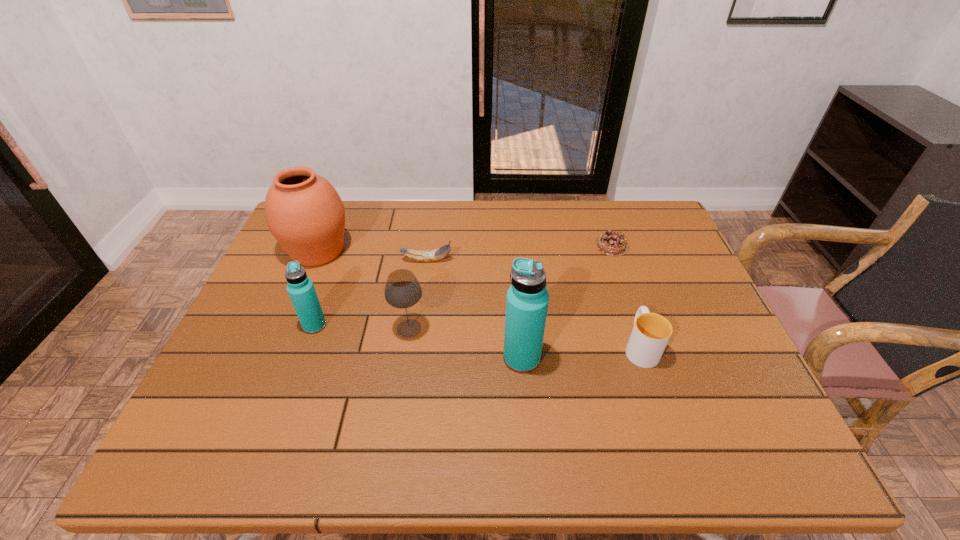
Find the location of `object present at the left edge`. object present at the left edge is located at coordinates (303, 211).

Where is `object present at the right edge`? Image resolution: width=960 pixels, height=540 pixels. object present at the right edge is located at coordinates (610, 243).

This screenshot has width=960, height=540. In order to click on object that is positioned at the far left corner in this screenshot , I will do `click(303, 211)`.

I want to click on object located in the far right corner section of the desktop, so click(x=610, y=243).

The width and height of the screenshot is (960, 540). What are the coordinates of `free region at the far edge of the desktop` in the screenshot? It's located at (376, 217).

In the image, there is a desktop. Where is `vacant space at the near edge`? The height and width of the screenshot is (540, 960). vacant space at the near edge is located at coordinates (519, 410).

Identify the location of vacant space at the left edge of the desktop. (258, 318).

In the image, there is a desktop. Identify the location of vacant region at the right edge. (644, 275).

In order to click on free spot between the sixth shortest object and the chocolate cake in this screenshot , I will do `click(465, 248)`.

Where is `empty location between the banana and the left water bottle`? empty location between the banana and the left water bottle is located at coordinates (371, 293).